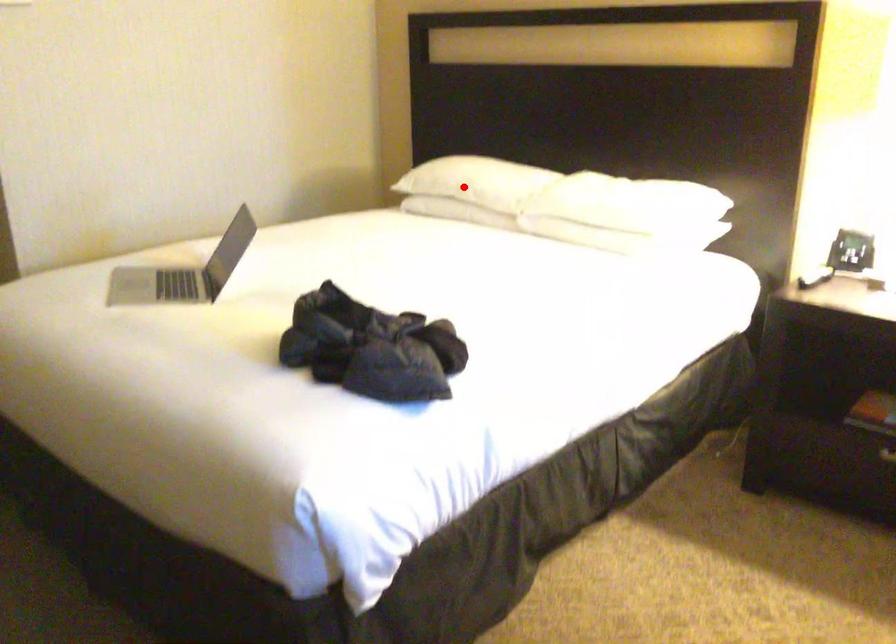
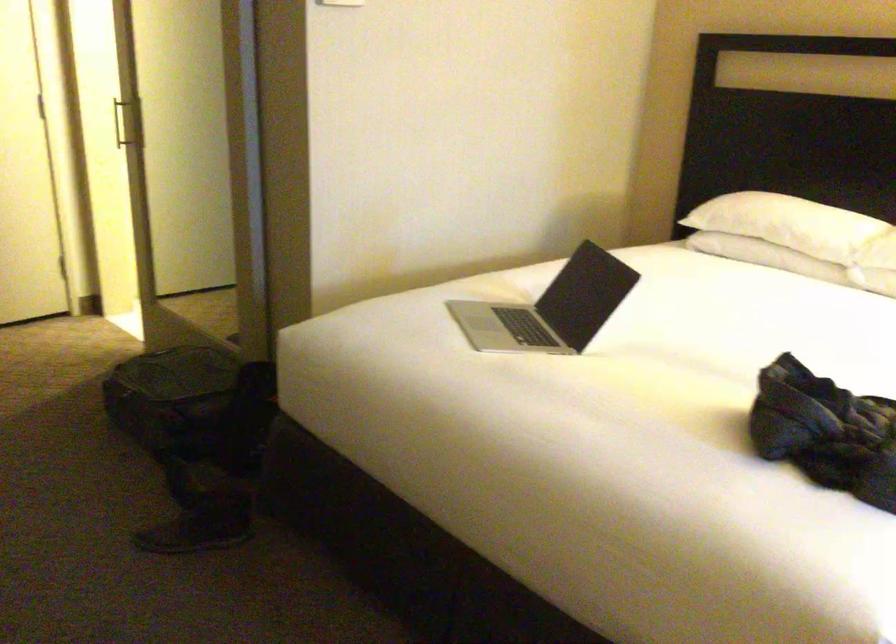
Question: I am providing you with two images of the same scene from different viewpoints. Image1 has a red point marked. In image2, the corresponding 3D location appears at what relative position? Reply with the corresponding letter.

Choices:
 (A) Closer
 (B) Farther

Answer: (A)